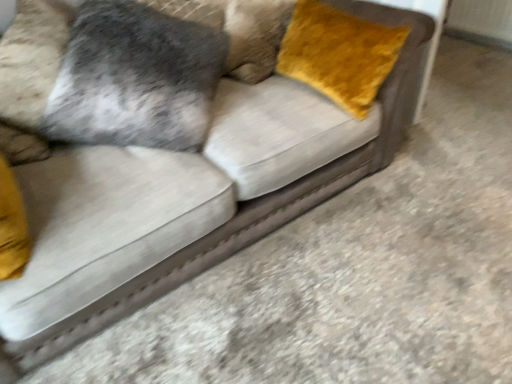
Question: Visually, is velvet yellow pillow at upper right positioned to the left or to the right of velvet gray pillow at upper left?

Choices:
 (A) right
 (B) left

Answer: (A)

Question: From a real-world perspective, is velvet yellow pillow at upper right above or below velvet gray pillow at upper left?

Choices:
 (A) below
 (B) above

Answer: (A)

Question: Considering the positions of velvet yellow pillow at upper right and velvet gray pillow at upper left in the image, is velvet yellow pillow at upper right bigger or smaller than velvet gray pillow at upper left?

Choices:
 (A) big
 (B) small

Answer: (B)

Question: Do you think velvet gray pillow at upper left is within velvet yellow pillow at upper right, or outside of it?

Choices:
 (A) outside
 (B) inside

Answer: (A)

Question: Looking at their shapes, would you say velvet gray pillow at upper left is wider or thinner than velvet yellow pillow at upper right?

Choices:
 (A) wide
 (B) thin

Answer: (A)

Question: Considering the positions of velvet gray pillow at upper left and velvet yellow pillow at upper right in the image, is velvet gray pillow at upper left bigger or smaller than velvet yellow pillow at upper right?

Choices:
 (A) big
 (B) small

Answer: (A)

Question: From a real-world perspective, is velvet gray pillow at upper left physically located above or below velvet yellow pillow at upper right?

Choices:
 (A) above
 (B) below

Answer: (A)